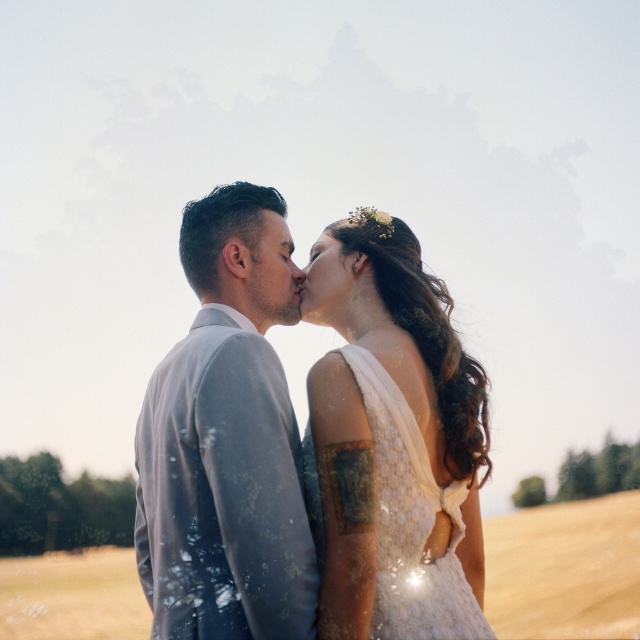
Looking at this image, in the scene of the couple sharing a kiss, which object is taller between the light gray suit at center and the matte floral hair accessory at center?

The light gray suit at center is taller than the matte floral hair accessory at center.

You are a photographer adjusting the camera focus. You need to ensure both the lace fabric dress at center and the matte floral hair accessory at center are in focus. Which object should you prioritize focusing on first to ensure proper depth of field?

The lace fabric dress at center is taller than the matte floral hair accessory at center, so focusing on the lace fabric dress at center first will help ensure proper depth of field for both objects.